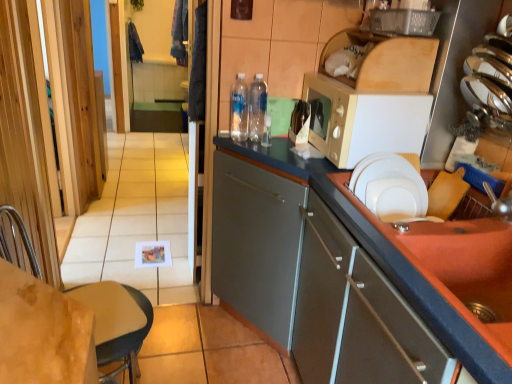
Find the location of a particular element. vacant space in between clear plastic bottles at center, positioned as the second bottle in left-to-right order, and translucent glass bottle at center, which is the 3th bottle in left-to-right order is located at coordinates (275, 142).